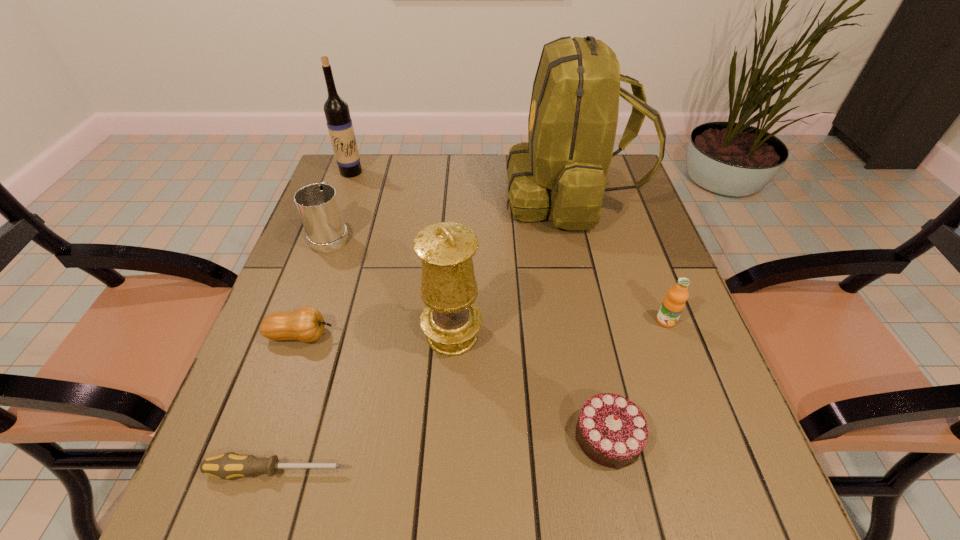
The width and height of the screenshot is (960, 540). I want to click on vacant area situated at the tip of the shortest object, so click(x=471, y=471).

The width and height of the screenshot is (960, 540). Identify the location of backpack present at the far edge. (562, 170).

Find the location of a particular element. wine bottle present at the far edge is located at coordinates (339, 122).

You are a GUI agent. You are given a task and a screenshot of the screen. Output one action in this format:
    pyautogui.click(x=<x>, y=<y>)
    Task: Click on the chocolate cake situated at the near edge
    This screenshot has height=540, width=960.
    Given the screenshot: What is the action you would take?
    point(611,430)

Identify the location of screwdriver that is at the near edge. Image resolution: width=960 pixels, height=540 pixels. (225, 466).

Where is `wine bottle that is positioned at the left edge`? wine bottle that is positioned at the left edge is located at coordinates (339, 122).

This screenshot has height=540, width=960. Identify the location of mug that is at the left edge. (317, 204).

This screenshot has height=540, width=960. What are the coordinates of `gourd at the left edge` in the screenshot? It's located at (306, 324).

Where is `screwdriver that is at the left edge`? This screenshot has width=960, height=540. screwdriver that is at the left edge is located at coordinates (225, 466).

The height and width of the screenshot is (540, 960). Identify the location of backpack located at the right edge. (562, 170).